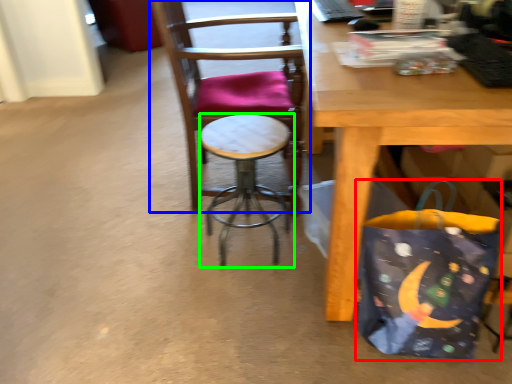
Question: Which object is positioned farthest from grocery bag (highlighted by a red box)? Select from chair (highlighted by a blue box) and stool (highlighted by a green box).

Choices:
 (A) chair
 (B) stool

Answer: (A)